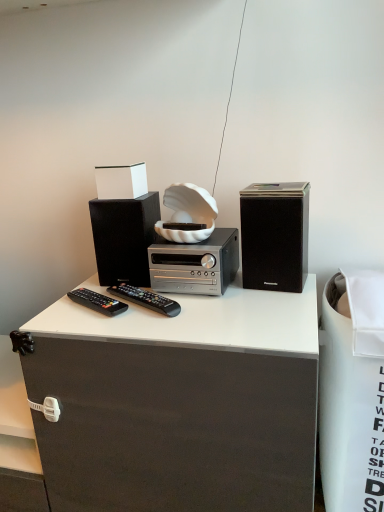
Question: From a real-world perspective, is white fabric trash bin at right positioned over white matte box at upper center based on gravity?

Choices:
 (A) no
 (B) yes

Answer: (A)

Question: Is white fabric trash bin at right at the right side of white matte box at upper center?

Choices:
 (A) no
 (B) yes

Answer: (B)

Question: Does white fabric trash bin at right appear on the left side of white matte box at upper center?

Choices:
 (A) no
 (B) yes

Answer: (A)

Question: Is white fabric trash bin at right looking in the opposite direction of white matte box at upper center?

Choices:
 (A) yes
 (B) no

Answer: (B)

Question: From the image's perspective, is white fabric trash bin at right over white matte box at upper center?

Choices:
 (A) yes
 (B) no

Answer: (B)

Question: Are white fabric trash bin at right and white matte box at upper center far apart?

Choices:
 (A) no
 (B) yes

Answer: (A)

Question: Are white matte box at upper center and white fabric trash bin at right located far from each other?

Choices:
 (A) yes
 (B) no

Answer: (B)

Question: Is white matte box at upper center in front of white fabric trash bin at right?

Choices:
 (A) no
 (B) yes

Answer: (A)

Question: Would you say white matte box at upper center is outside white fabric trash bin at right?

Choices:
 (A) yes
 (B) no

Answer: (A)

Question: Considering the relative sizes of white matte box at upper center and white fabric trash bin at right in the image provided, is white matte box at upper center thinner than white fabric trash bin at right?

Choices:
 (A) yes
 (B) no

Answer: (A)

Question: Can you confirm if white matte box at upper center is positioned to the right of white fabric trash bin at right?

Choices:
 (A) no
 (B) yes

Answer: (A)

Question: Is white matte box at upper center looking in the opposite direction of white fabric trash bin at right?

Choices:
 (A) yes
 (B) no

Answer: (B)

Question: From the image's perspective, is silver metallic stereo at center on top of black plastic remote at center, the 1th remote control in the right-to-left sequence?

Choices:
 (A) yes
 (B) no

Answer: (A)